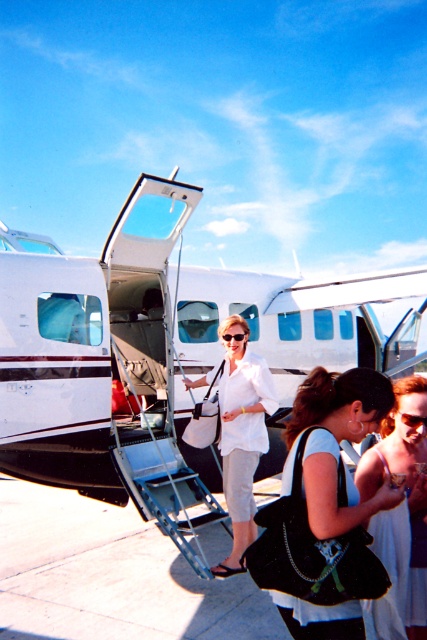
You are a passenger standing on the ground near the airplane steps. You want to pick up your velvet black purse at center before boarding the white matte airplane at center. Is the purse currently accessible to you without moving the airplane?

The white matte airplane at center is positioned over velvet black purse at center, so the purse is underneath the airplane. You cannot access it without moving the airplane.

You are a passenger at the airport and see the white matte airplane at center and the white matte skirt at center. Which object is positioned higher from the ground?

The white matte airplane at center is positioned higher from the ground than the white matte skirt at center because it is located above it.

You are an airport staff member checking the boarding area. You notice the white matte airplane at center and the white matte skirt at center. Which object is shorter in height?

The white matte airplane at center is not as tall as the white matte skirt at center, so the airplane is shorter in height.